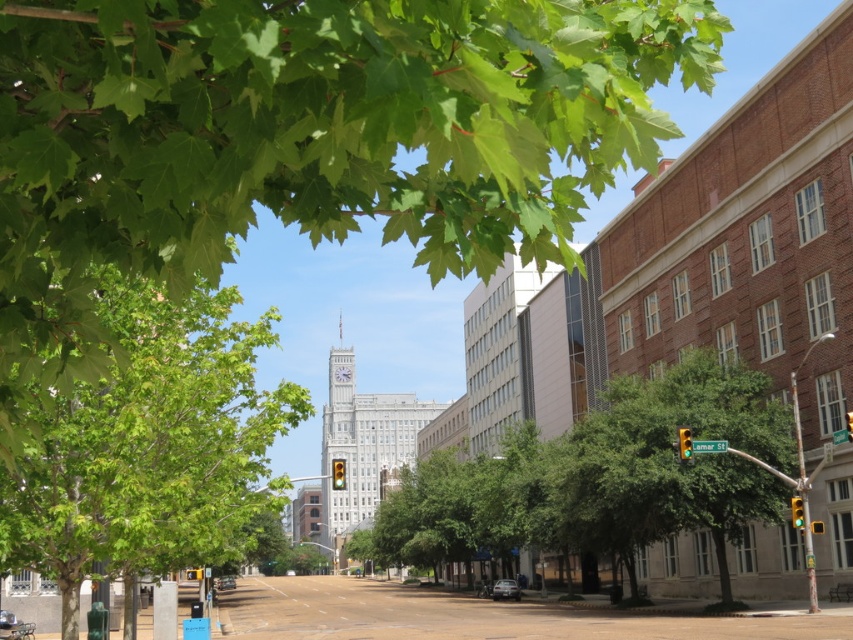
From the picture: You are a city planner designing a new park and need to place two green leafy trees exactly 100 feet apart. You have two trees labeled as green leafy tree at left and green leafy tree at center. Based on the image, can you determine if their current spacing meets the requirement?

The green leafy tree at left is 98.22 feet from the green leafy tree at center, which is slightly less than the required 100 feet. Therefore, their current spacing does not meet the requirement.

You are a photographer planning to capture the entire city view without any obstruction. You notice two green leafy trees in the scene. Which tree, the green leafy tree at upper left or the green leafy tree at center, would you need to position your camera around to avoid blocking the city view?

The green leafy tree at upper left occupies less space than the green leafy tree at center, so positioning the camera around the larger green leafy tree at center would be necessary to avoid blocking the city view.